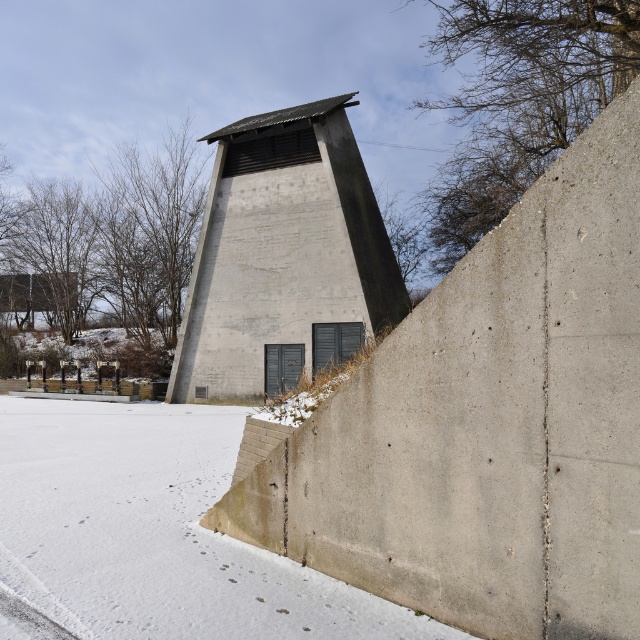
Does white powdery snow at lower left come in front of concrete tower at center?

That is True.

Who is positioned more to the left, white powdery snow at lower left or concrete tower at center?

white powdery snow at lower left

The height and width of the screenshot is (640, 640). What do you see at coordinates (156, 531) in the screenshot? I see `white powdery snow at lower left` at bounding box center [156, 531].

You are a GUI agent. You are given a task and a screenshot of the screen. Output one action in this format:
    pyautogui.click(x=<x>, y=<y>)
    Task: Click on the white powdery snow at lower left
    The width and height of the screenshot is (640, 640).
    Given the screenshot: What is the action you would take?
    pyautogui.click(x=156, y=531)